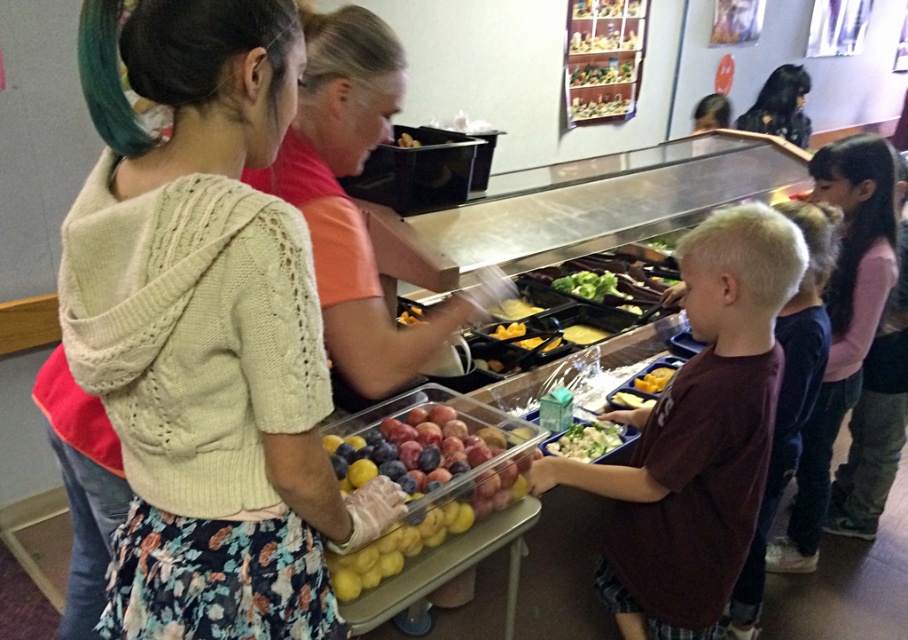
Question: Which object is the farthest from the knitted beige sweater at upper left?

Choices:
 (A) dark brown t-shirt at center
 (B) yellow matte plastic tray at center
 (C) matte orange shirt at center

Answer: (B)

Question: Which of the following is the closest to the observer?

Choices:
 (A) (834, 433)
 (B) (403, 145)

Answer: (B)

Question: Does dark brown t-shirt at center appear under yellow matte cheese at center?

Choices:
 (A) no
 (B) yes

Answer: (B)

Question: Can you confirm if yellow matte lemons at center is positioned to the left of yellow matte apple at center?

Choices:
 (A) yes
 (B) no

Answer: (B)

Question: Can you confirm if knitted beige sweater at upper left is thinner than matte orange shirt at center?

Choices:
 (A) no
 (B) yes

Answer: (B)

Question: Which point is farther to the camera?

Choices:
 (A) (656, 369)
 (B) (790, 298)
 (C) (191, 516)
 (D) (398, 140)

Answer: (A)